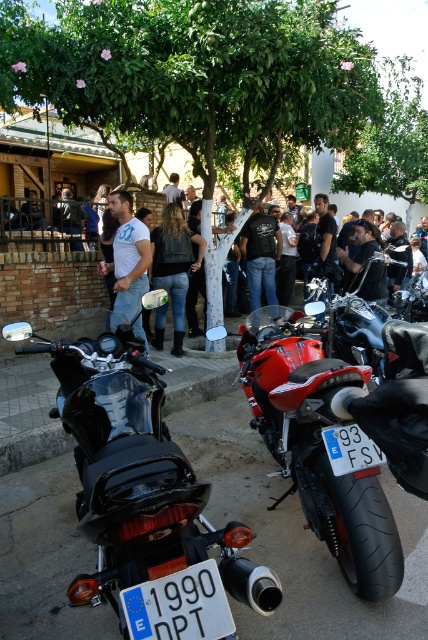
You are standing in the middle of the scene and want to take a photo. There are two points in the image labeled as point (312, 486) and point (205, 241). Which point will appear larger in your photo?

Point (312, 486) is closer to the camera than point (205, 241), so it will appear larger in the photo.